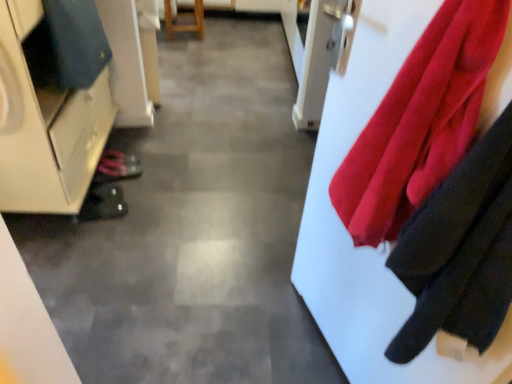
Question: Is dark blue fabric at left positioned before matte white cabinet at left?

Choices:
 (A) no
 (B) yes

Answer: (A)

Question: Is dark blue fabric at left touching matte white cabinet at left?

Choices:
 (A) yes
 (B) no

Answer: (B)

Question: Is dark blue fabric at left facing away from matte white cabinet at left?

Choices:
 (A) no
 (B) yes

Answer: (B)

Question: Is there a large distance between dark blue fabric at left and matte white cabinet at left?

Choices:
 (A) no
 (B) yes

Answer: (A)

Question: From the image's perspective, would you say dark blue fabric at left is shown under matte white cabinet at left?

Choices:
 (A) yes
 (B) no

Answer: (B)

Question: Is dark blue fabric at left wider than matte white cabinet at left?

Choices:
 (A) yes
 (B) no

Answer: (B)

Question: Is matte white cabinet at left wider than shiny black shoe at lower left, the 2th shoe from the front?

Choices:
 (A) no
 (B) yes

Answer: (B)

Question: Would you say matte white cabinet at left is outside shiny black shoe at lower left, the second shoe from the bottom?

Choices:
 (A) no
 (B) yes

Answer: (B)

Question: Considering the relative positions of matte white cabinet at left and shiny black shoe at lower left, the 2th shoe from the front, in the image provided, is matte white cabinet at left to the right of shiny black shoe at lower left, the 2th shoe from the front, from the viewer's perspective?

Choices:
 (A) yes
 (B) no

Answer: (B)

Question: Considering the relative positions of matte white cabinet at left and shiny black shoe at lower left, the second shoe from the bottom, in the image provided, is matte white cabinet at left to the left of shiny black shoe at lower left, the second shoe from the bottom, from the viewer's perspective?

Choices:
 (A) no
 (B) yes

Answer: (B)

Question: Is matte white cabinet at left further to camera compared to shiny black shoe at lower left, the second shoe from the bottom?

Choices:
 (A) yes
 (B) no

Answer: (B)

Question: Considering the relative sizes of matte white cabinet at left and shiny black shoe at lower left, placed as the 1th shoe when sorted from back to front, in the image provided, is matte white cabinet at left taller than shiny black shoe at lower left, placed as the 1th shoe when sorted from back to front,?

Choices:
 (A) no
 (B) yes

Answer: (B)

Question: Is shiny black shoe at lower left, the second shoe from the bottom, with matte white cabinet at left?

Choices:
 (A) no
 (B) yes

Answer: (A)